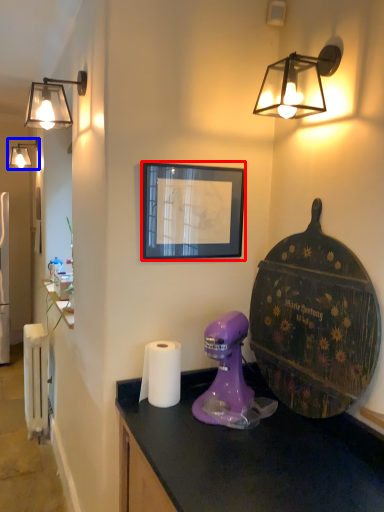
Question: Among these objects, which one is farthest to the camera, picture frame (highlighted by a red box) or lamp (highlighted by a blue box)?

Choices:
 (A) picture frame
 (B) lamp

Answer: (B)